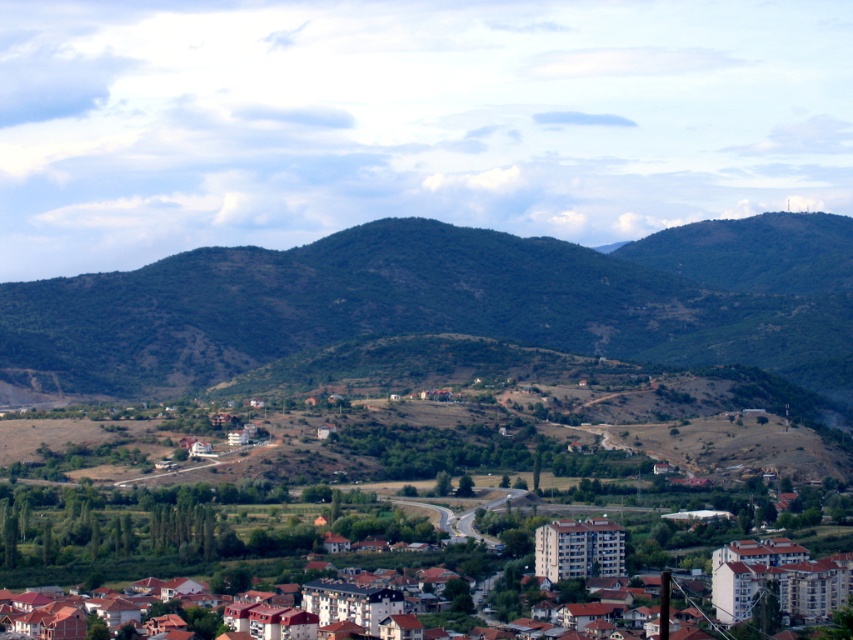
Question: Can you confirm if green leafy hillside at center is positioned to the left of brown brick houses at center?

Choices:
 (A) yes
 (B) no

Answer: (B)

Question: Which point is farther to the camera?

Choices:
 (A) (241, 582)
 (B) (795, 282)

Answer: (B)

Question: Is green leafy hillside at center behind brown brick houses at center?

Choices:
 (A) no
 (B) yes

Answer: (A)

Question: Which object is closer to the camera taking this photo?

Choices:
 (A) green leafy hillside at center
 (B) brown brick houses at center

Answer: (A)

Question: Does green leafy hillside at center appear under brown brick houses at center?

Choices:
 (A) no
 (B) yes

Answer: (A)